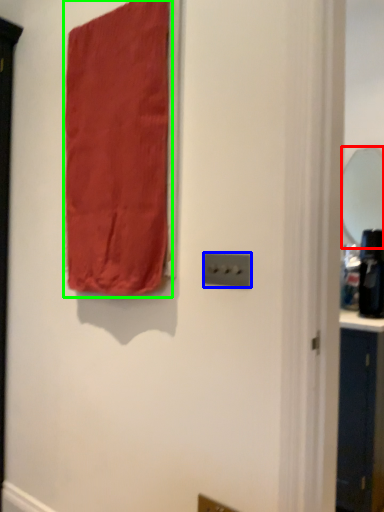
Question: Which is nearer to the mirror (highlighted by a red box)? light switch (highlighted by a blue box) or curtain (highlighted by a green box).

Choices:
 (A) light switch
 (B) curtain

Answer: (B)